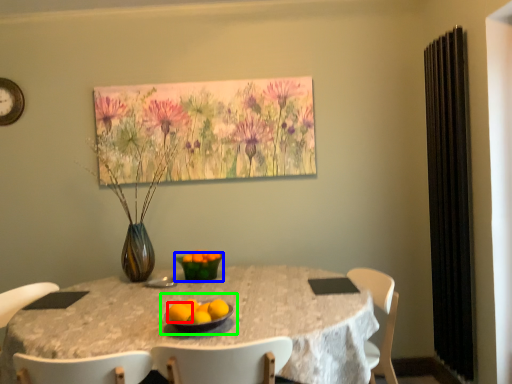
Question: Based on their relative distances, which object is farther from orange (highlighted by a red box)? Choose from glass bowl (highlighted by a blue box) and fruit dish (highlighted by a green box).

Choices:
 (A) glass bowl
 (B) fruit dish

Answer: (A)